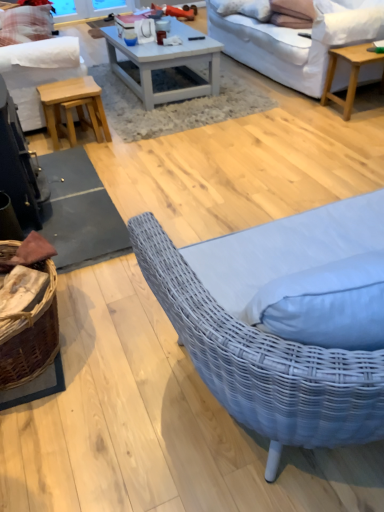
Question: Does light brown wooden stool at left have a greater height compared to light wood/texture coffee table at upper right, which is the first coffee table in right-to-left order?

Choices:
 (A) no
 (B) yes

Answer: (A)

Question: Is light brown wooden stool at left thinner than light wood/texture coffee table at upper right, marked as the second coffee table in a left-to-right arrangement?

Choices:
 (A) no
 (B) yes

Answer: (B)

Question: From a real-world perspective, is light brown wooden stool at left located higher than light wood/texture coffee table at upper right, marked as the second coffee table in a left-to-right arrangement?

Choices:
 (A) no
 (B) yes

Answer: (A)

Question: Are light brown wooden stool at left and light wood/texture coffee table at upper right, marked as the second coffee table in a left-to-right arrangement, located far from each other?

Choices:
 (A) no
 (B) yes

Answer: (B)

Question: Could you tell me if light brown wooden stool at left is facing light wood/texture coffee table at upper right, marked as the second coffee table in a left-to-right arrangement?

Choices:
 (A) yes
 (B) no

Answer: (A)

Question: Does light brown wooden stool at left have a lesser height compared to light wood/texture coffee table at upper right, marked as the second coffee table in a left-to-right arrangement?

Choices:
 (A) no
 (B) yes

Answer: (B)

Question: From a real-world perspective, is white textured pillow at upper center, the second pillow in the back-to-front sequence, located higher than white fabric studio couch at upper right, which is counted as the 2th studio couch, starting from the left?

Choices:
 (A) yes
 (B) no

Answer: (A)

Question: Is white textured pillow at upper center, the second pillow positioned from the right, far away from white fabric studio couch at upper right, the 1th studio couch when ordered from right to left?

Choices:
 (A) yes
 (B) no

Answer: (B)

Question: From the image's perspective, is white textured pillow at upper center, the second pillow from the front, beneath white fabric studio couch at upper right, the 1th studio couch when ordered from right to left?

Choices:
 (A) no
 (B) yes

Answer: (A)

Question: Considering the relative positions of white textured pillow at upper center, the 2th pillow positioned from the top, and white fabric studio couch at upper right, the 1th studio couch when ordered from right to left, in the image provided, is white textured pillow at upper center, the 2th pillow positioned from the top, to the left of white fabric studio couch at upper right, the 1th studio couch when ordered from right to left, from the viewer's perspective?

Choices:
 (A) no
 (B) yes

Answer: (B)

Question: Is white textured pillow at upper center, the second pillow positioned from the right, looking in the opposite direction of white fabric studio couch at upper right, the 1th studio couch when ordered from right to left?

Choices:
 (A) no
 (B) yes

Answer: (B)

Question: From the image's perspective, would you say white textured pillow at upper center, the 2th pillow positioned from the top, is positioned over white fabric studio couch at upper right, the 1th studio couch when ordered from right to left?

Choices:
 (A) no
 (B) yes

Answer: (B)

Question: Can you confirm if white painted wood coffee table at center, the 2th coffee table positioned from the right, is positioned to the left of light brown wooden stool at left?

Choices:
 (A) yes
 (B) no

Answer: (B)